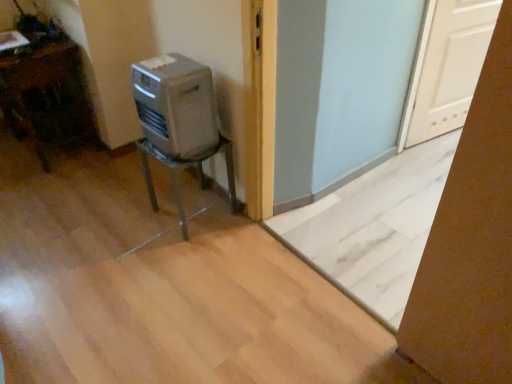
Find the location of a particular element. free spot in front of metallic gray chair at center-left, which is the first furniture in right-to-left order is located at coordinates (188, 253).